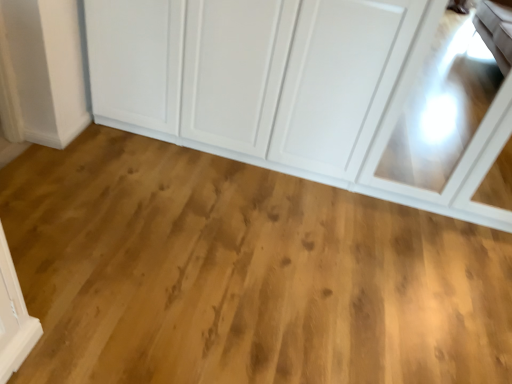
Question: Is natural wood floor at center to the left of white glossy cupboard at upper center from the viewer's perspective?

Choices:
 (A) yes
 (B) no

Answer: (A)

Question: Is natural wood floor at center facing away from white glossy cupboard at upper center?

Choices:
 (A) yes
 (B) no

Answer: (B)

Question: From the image's perspective, would you say natural wood floor at center is shown under white glossy cupboard at upper center?

Choices:
 (A) no
 (B) yes

Answer: (B)

Question: From the image's perspective, is natural wood floor at center on white glossy cupboard at upper center?

Choices:
 (A) no
 (B) yes

Answer: (A)

Question: From a real-world perspective, is natural wood floor at center on white glossy cupboard at upper center?

Choices:
 (A) yes
 (B) no

Answer: (B)

Question: Is the depth of natural wood floor at center less than that of white glossy cupboard at upper center?

Choices:
 (A) no
 (B) yes

Answer: (B)

Question: Does white glossy cupboard at upper center turn towards natural wood floor at center?

Choices:
 (A) no
 (B) yes

Answer: (B)

Question: From the image's perspective, would you say white glossy cupboard at upper center is positioned over natural wood floor at center?

Choices:
 (A) yes
 (B) no

Answer: (A)

Question: Is white glossy cupboard at upper center to the right of natural wood floor at center from the viewer's perspective?

Choices:
 (A) yes
 (B) no

Answer: (A)

Question: Is natural wood floor at center completely or partially inside white glossy cupboard at upper center?

Choices:
 (A) yes
 (B) no

Answer: (B)

Question: From a real-world perspective, is white glossy cupboard at upper center positioned under natural wood floor at center based on gravity?

Choices:
 (A) yes
 (B) no

Answer: (B)

Question: Is white glossy cupboard at upper center not inside natural wood floor at center?

Choices:
 (A) yes
 (B) no

Answer: (A)

Question: Is natural wood floor at center to the left or to the right of white glossy cupboard at upper center in the image?

Choices:
 (A) right
 (B) left

Answer: (B)